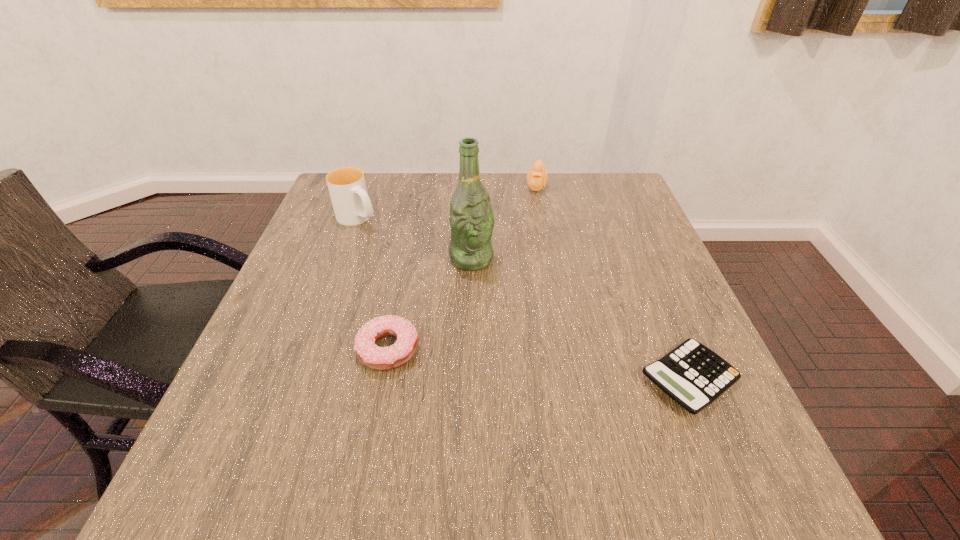
You are a GUI agent. You are given a task and a screenshot of the screen. Output one action in this format:
    pyautogui.click(x=<x>, y=<y>)
    Task: Click on the second object from left to right
    This screenshot has height=540, width=960.
    Given the screenshot: What is the action you would take?
    pyautogui.click(x=378, y=358)

You are a GUI agent. You are given a task and a screenshot of the screen. Output one action in this format:
    pyautogui.click(x=<x>, y=<y>)
    Task: Click on the fourth tallest object
    The width and height of the screenshot is (960, 540).
    Given the screenshot: What is the action you would take?
    pyautogui.click(x=378, y=358)

Find the location of `the shortest object`. the shortest object is located at coordinates (694, 376).

Image resolution: width=960 pixels, height=540 pixels. Find the location of `calculator`. calculator is located at coordinates (694, 376).

What are the coordinates of `duckling` in the screenshot? It's located at (537, 177).

Where is `the fourth object from left to right`? The height and width of the screenshot is (540, 960). the fourth object from left to right is located at coordinates pyautogui.click(x=537, y=177).

Locate an element on the screen. The height and width of the screenshot is (540, 960). the leftmost object is located at coordinates [x=352, y=206].

I want to click on the second farthest object, so click(x=352, y=206).

Locate an element on the screen. Image resolution: width=960 pixels, height=540 pixels. the third nearest object is located at coordinates (471, 219).

In order to click on the third object from left to right in this screenshot , I will do `click(471, 219)`.